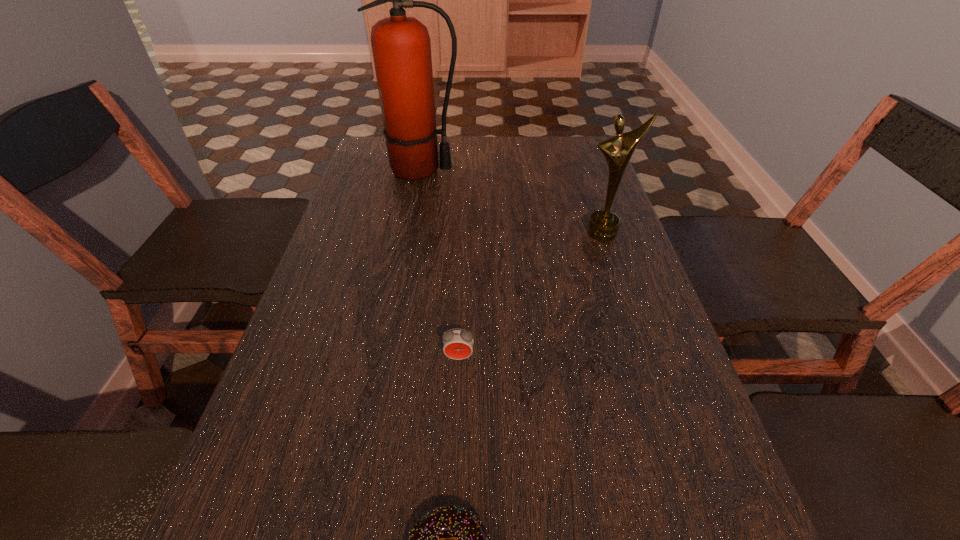
Identify the location of the farthest object. (401, 46).

Identify the location of fire extinguisher. (401, 46).

Identify the location of the second tallest object. (603, 225).

At what (x,y) coordinates should I click in order to perform the action: click on the rightmost object. Please return your answer as a coordinate pair (x, y). This screenshot has height=540, width=960. Looking at the image, I should click on (603, 225).

Where is `the second nearest object`? the second nearest object is located at coordinates (457, 344).

Image resolution: width=960 pixels, height=540 pixels. In order to click on alarm clock in this screenshot , I will do `click(457, 344)`.

Locate an element on the screen. The height and width of the screenshot is (540, 960). blank space located on the nozzle of the fire extinguisher is located at coordinates click(x=529, y=170).

Identify the location of vacant position located 0.370m on the front-facing side of the third shortest object. The width and height of the screenshot is (960, 540). (646, 365).

Where is `blank area located 0.070m on the face of the third tallest object`? The height and width of the screenshot is (540, 960). blank area located 0.070m on the face of the third tallest object is located at coordinates (457, 396).

Image resolution: width=960 pixels, height=540 pixels. Find the location of `object at the far edge`. object at the far edge is located at coordinates (401, 46).